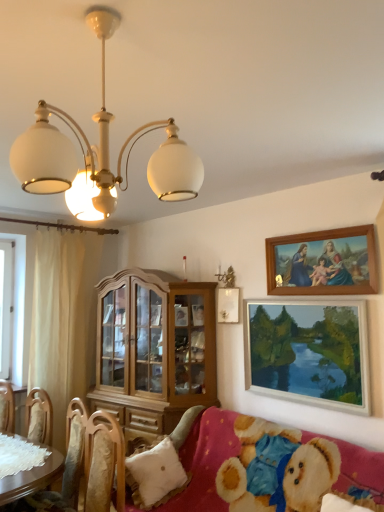
Question: Is wooden picture frame at lower right, the first picture frame from the bottom, bigger or smaller than beige fabric curtain at left?

Choices:
 (A) big
 (B) small

Answer: (B)

Question: From the image's perspective, is wooden picture frame at lower right, the first picture frame from the bottom, above or below beige fabric curtain at left?

Choices:
 (A) below
 (B) above

Answer: (B)

Question: Estimate the real-world distances between objects in this image. Which object is closer to the wooden picture frame at lower right, the first picture frame from the bottom?

Choices:
 (A) fluffy pink fabric couch at lower right
 (B) beige fabric curtain at left
 (C) light wood cabinet at center
 (D) white glossy chandelier at upper center
 (E) wooden chair at lower left

Answer: (A)

Question: Which is farther from the wooden picture frame at lower right, marked as the second picture frame in a top-to-bottom arrangement?

Choices:
 (A) white fluffy pillow at lower left
 (B) fluffy pink fabric couch at lower right
 (C) wooden picture frame at upper right, marked as the 1th picture frame in a top-to-bottom arrangement
 (D) wooden chair at lower left
 (E) beige fabric curtain at left

Answer: (E)